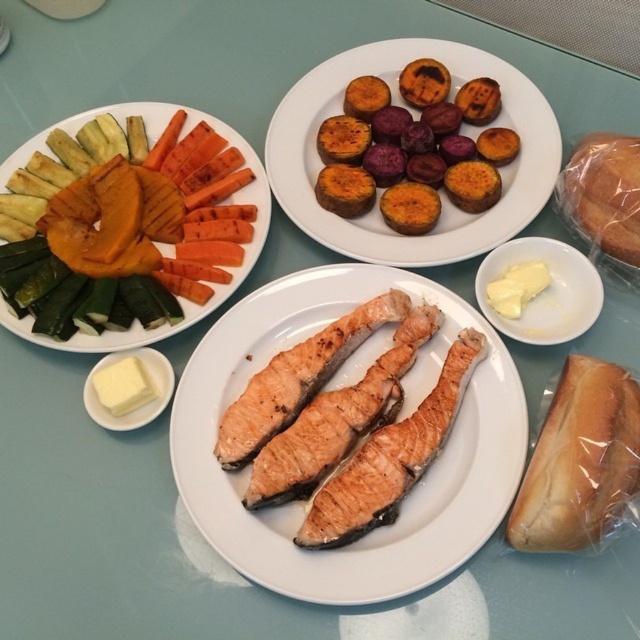
Is point (196, 524) positioned in front of point (358, 234)?

Yes, it is in front of point (358, 234).

Who is taller, golden brown salmon at center or smooth orange sweet potato slices at center?

With more height is golden brown salmon at center.

At what (x,y) coordinates should I click in order to perform the action: click on golden brown salmon at center. Please return your answer as a coordinate pair (x, y). The width and height of the screenshot is (640, 640). Looking at the image, I should click on (397, 420).

Which is behind, point (412, 56) or point (577, 189)?

The point (412, 56) is more distant.

Is smooth orange sweet potato slices at center smaller than translucent plastic bread at upper right?

No, smooth orange sweet potato slices at center is not smaller than translucent plastic bread at upper right.

Locate an element on the screen. The height and width of the screenshot is (640, 640). smooth orange sweet potato slices at center is located at coordinates (413, 116).

Who is higher up, golden brown salmon at center or grilled vegetables at upper left?

grilled vegetables at upper left is above.

What do you see at coordinates (397, 420) in the screenshot?
I see `golden brown salmon at center` at bounding box center [397, 420].

Does point (426, 570) come closer to viewer compared to point (170, 326)?

Yes, point (426, 570) is in front of point (170, 326).

Locate an element on the screen. golden brown salmon at center is located at coordinates (397, 420).